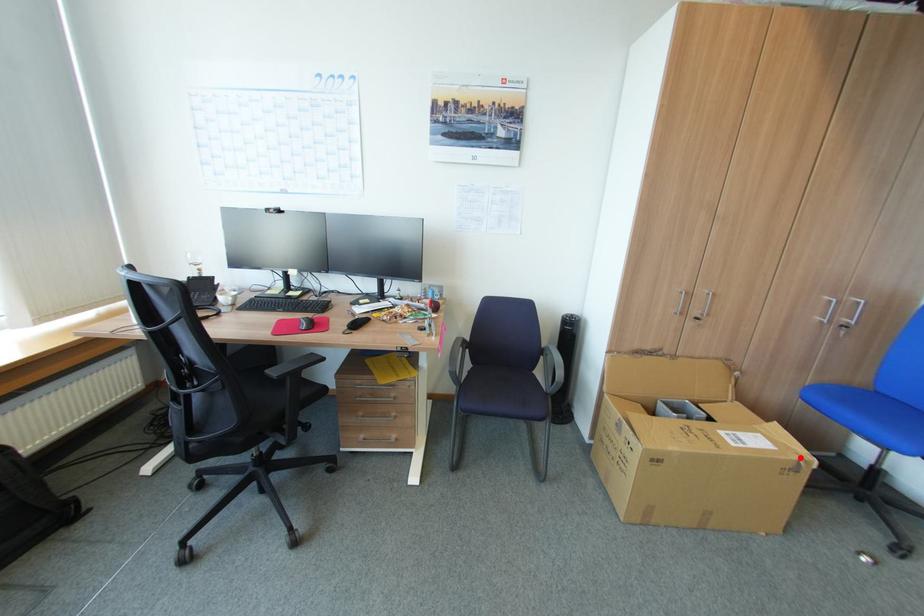
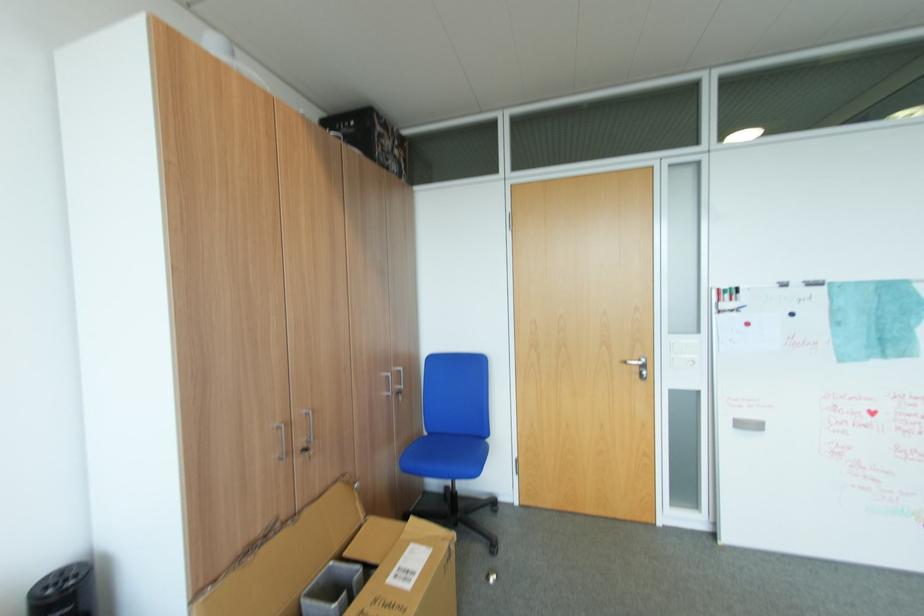
Locate, in the second image, the point that corresponds to the highlighted location in the first image.

(451, 544)